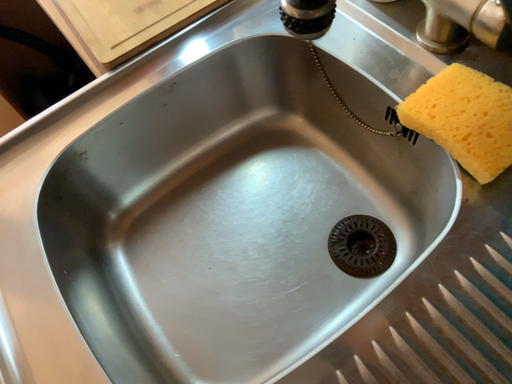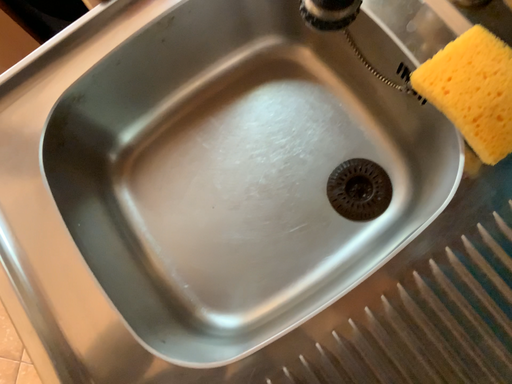
Question: Which way did the camera rotate in the video?

Choices:
 (A) rotated upward
 (B) rotated downward

Answer: (B)